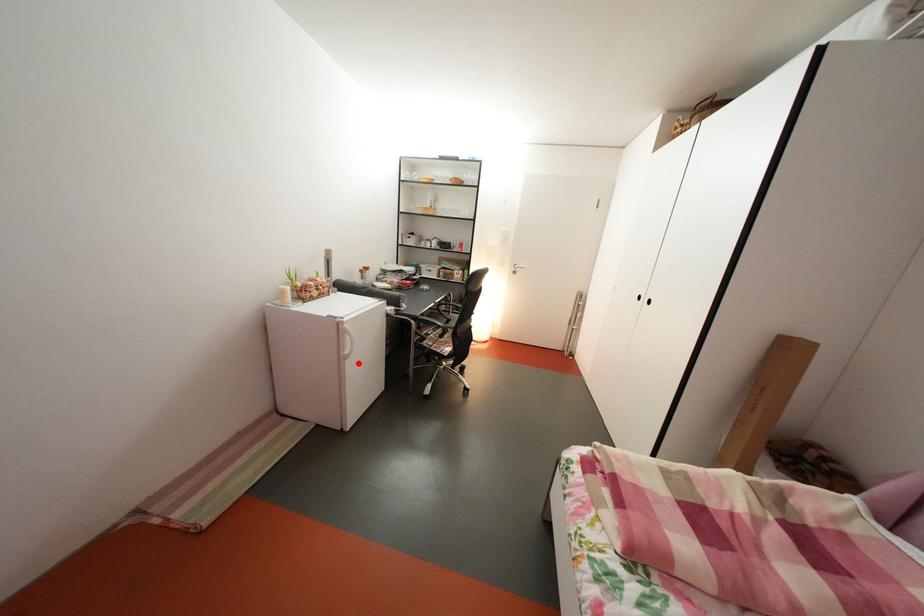
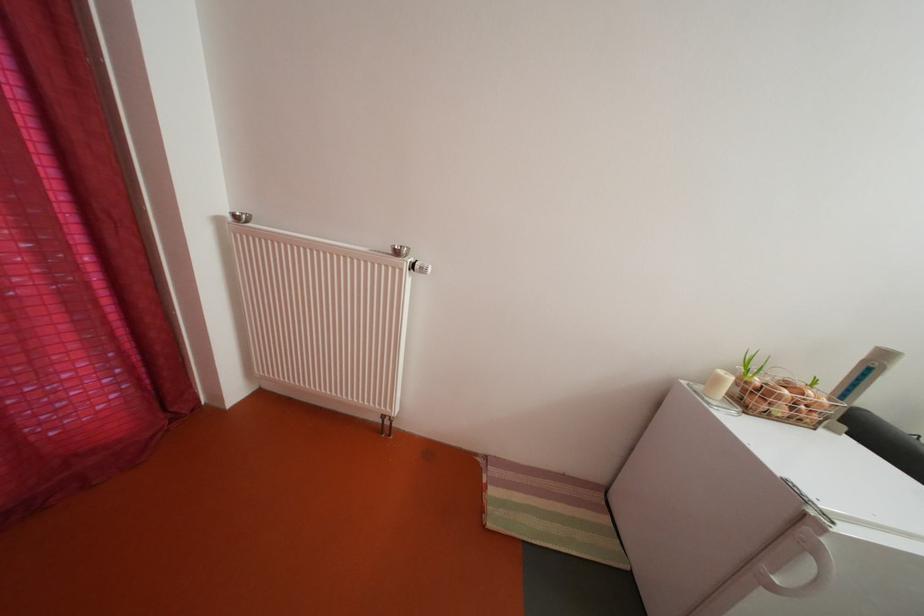
Question: I am providing you with two images of the same scene from different viewpoints. In image1, a red point is highlighted. Considering the same 3D point in image2, which of the following is correct?

Choices:
 (A) It is closer
 (B) It is farther

Answer: (A)